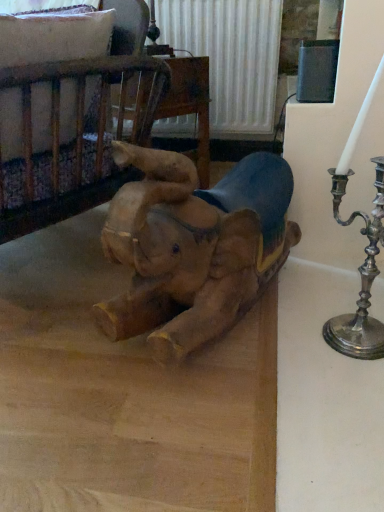
Question: Considering the relative sizes of wooden crib at upper left and wooden elephant at center in the image provided, is wooden crib at upper left shorter than wooden elephant at center?

Choices:
 (A) yes
 (B) no

Answer: (B)

Question: Is the position of wooden crib at upper left more distant than that of wooden elephant at center?

Choices:
 (A) no
 (B) yes

Answer: (B)

Question: Are wooden crib at upper left and wooden elephant at center making contact?

Choices:
 (A) yes
 (B) no

Answer: (B)

Question: Does wooden crib at upper left have a greater height compared to wooden elephant at center?

Choices:
 (A) no
 (B) yes

Answer: (B)

Question: From the image's perspective, is wooden crib at upper left located above wooden elephant at center?

Choices:
 (A) no
 (B) yes

Answer: (B)

Question: Is wooden crib at upper left far from wooden elephant at center?

Choices:
 (A) no
 (B) yes

Answer: (A)

Question: Considering the relative sizes of wooden elephant at center and wooden elephant at center in the image provided, is wooden elephant at center taller than wooden elephant at center?

Choices:
 (A) yes
 (B) no

Answer: (B)

Question: Is wooden elephant at center oriented away from wooden elephant at center?

Choices:
 (A) yes
 (B) no

Answer: (A)

Question: Considering the relative positions of wooden elephant at center and wooden elephant at center in the image provided, is wooden elephant at center to the right of wooden elephant at center from the viewer's perspective?

Choices:
 (A) yes
 (B) no

Answer: (B)

Question: Is the surface of wooden elephant at center in direct contact with wooden elephant at center?

Choices:
 (A) yes
 (B) no

Answer: (B)

Question: From a real-world perspective, is wooden elephant at center below wooden elephant at center?

Choices:
 (A) no
 (B) yes

Answer: (B)

Question: Does wooden elephant at center contain wooden elephant at center?

Choices:
 (A) no
 (B) yes

Answer: (A)

Question: Does wooden crib at upper left have a smaller size compared to wooden elephant at center?

Choices:
 (A) yes
 (B) no

Answer: (A)